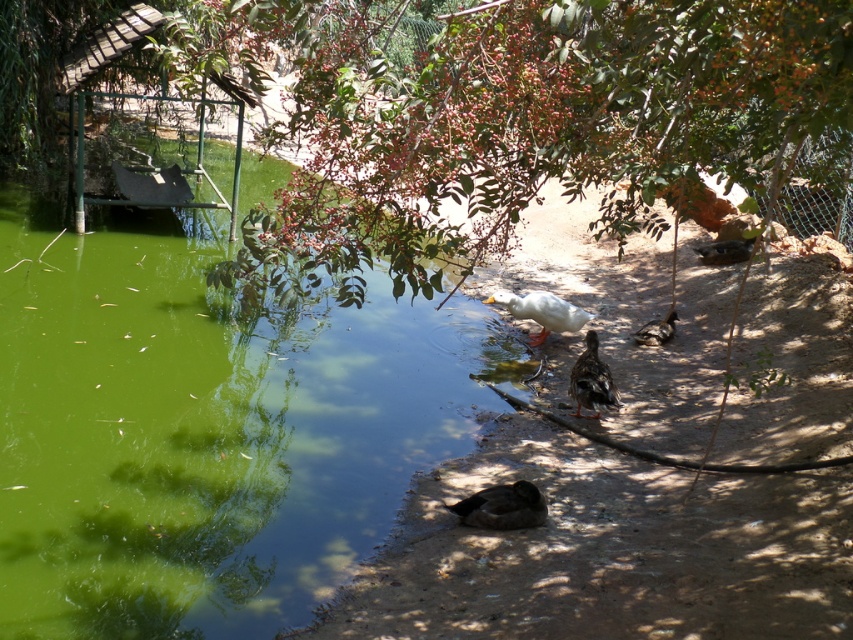
Looking at this image, which is more to the left, brown speckled duck at center or brown matte duck at center-right?

brown speckled duck at center is more to the left.

Does brown speckled duck at center come behind brown matte duck at center-right?

No, it is in front of brown matte duck at center-right.

Find the location of a particular element. brown speckled duck at center is located at coordinates (590, 380).

Locate an element on the screen. This screenshot has height=640, width=853. brown speckled duck at center is located at coordinates (590, 380).

Does point (442, 362) lie behind point (659, 324)?

No, (442, 362) is closer to viewer.

Measure the distance between green algae water at lower left and camera.

A distance of 2.98 meters exists between green algae water at lower left and camera.

What do you see at coordinates (204, 428) in the screenshot? The width and height of the screenshot is (853, 640). I see `green algae water at lower left` at bounding box center [204, 428].

You are a GUI agent. You are given a task and a screenshot of the screen. Output one action in this format:
    pyautogui.click(x=<x>, y=<y>)
    Task: Click on the green algae water at lower left
    This screenshot has width=853, height=640.
    Given the screenshot: What is the action you would take?
    pyautogui.click(x=204, y=428)

Can you confirm if brown fuzzy duck at lower center is thinner than brown matte duck at center-right?

No, brown fuzzy duck at lower center is not thinner than brown matte duck at center-right.

Which is behind, point (502, 513) or point (662, 321)?

The point (662, 321) is behind.

Identify the location of brown fuzzy duck at lower center. Image resolution: width=853 pixels, height=640 pixels. (502, 506).